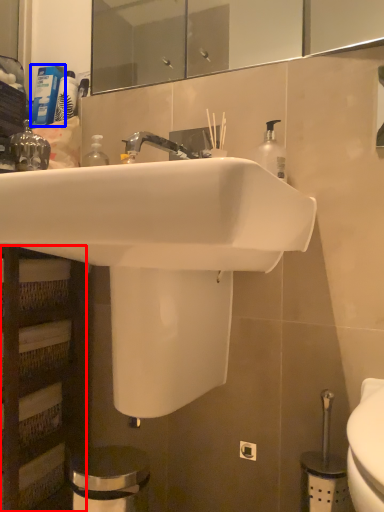
Question: Which object is closer to the camera taking this photo, shelf (highlighted by a red box) or toiletry (highlighted by a blue box)?

Choices:
 (A) shelf
 (B) toiletry

Answer: (A)